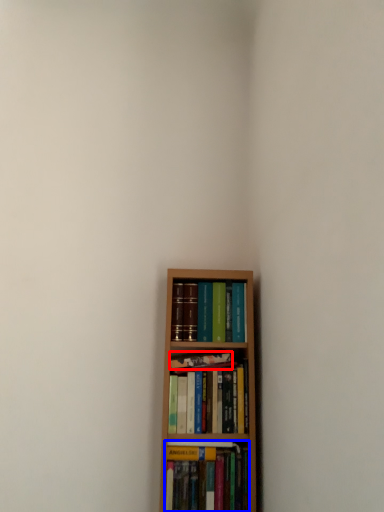
Question: Which of the following is the closest to the observer, book (highlighted by a red box) or book (highlighted by a blue box)?

Choices:
 (A) book
 (B) book

Answer: (B)